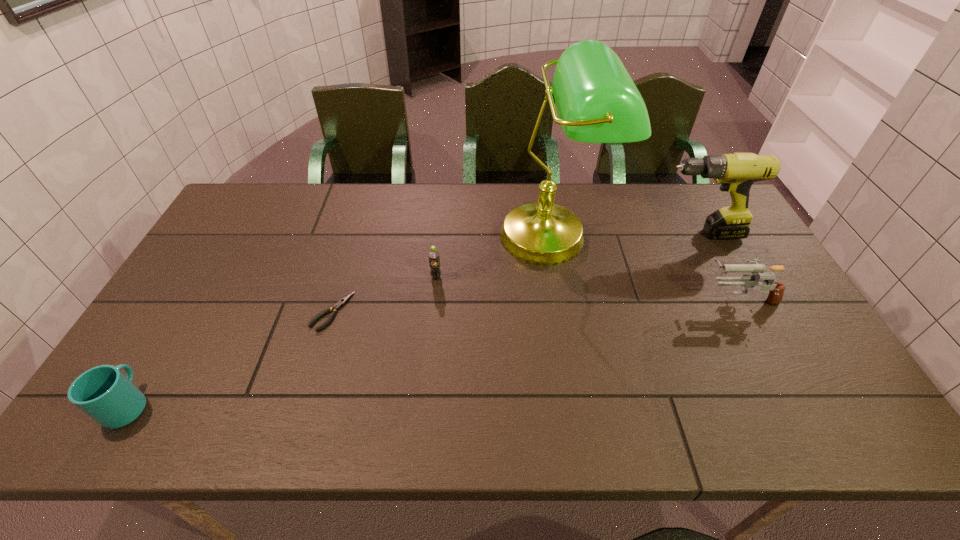
At what (x,y) coordinates should I click in order to perform the action: click on the tallest object. Please return your answer as a coordinate pair (x, y). The height and width of the screenshot is (540, 960). Looking at the image, I should click on (597, 101).

Locate an element on the screen. The image size is (960, 540). the third object from right to left is located at coordinates (597, 101).

Find the location of a particular element. drill is located at coordinates (736, 172).

Where is `gun`? gun is located at coordinates (776, 289).

The image size is (960, 540). I want to click on the fourth object from right to left, so click(434, 257).

Where is `the nearest object`? The height and width of the screenshot is (540, 960). the nearest object is located at coordinates (104, 393).

This screenshot has width=960, height=540. What are the coordinates of `cup` in the screenshot? It's located at (104, 393).

Where is `the shortest object`? the shortest object is located at coordinates (341, 302).

You are a GUI agent. You are given a task and a screenshot of the screen. Output one action in this format:
    pyautogui.click(x=<x>, y=<y>)
    Task: Click on the pliers
    Image resolution: width=960 pixels, height=540 pixels.
    Given the screenshot: What is the action you would take?
    (341, 302)

Find the location of a particular element. The width and height of the screenshot is (960, 540). vacant space located 0.140m on the desk next to the fourth object from left to right is located at coordinates (566, 317).